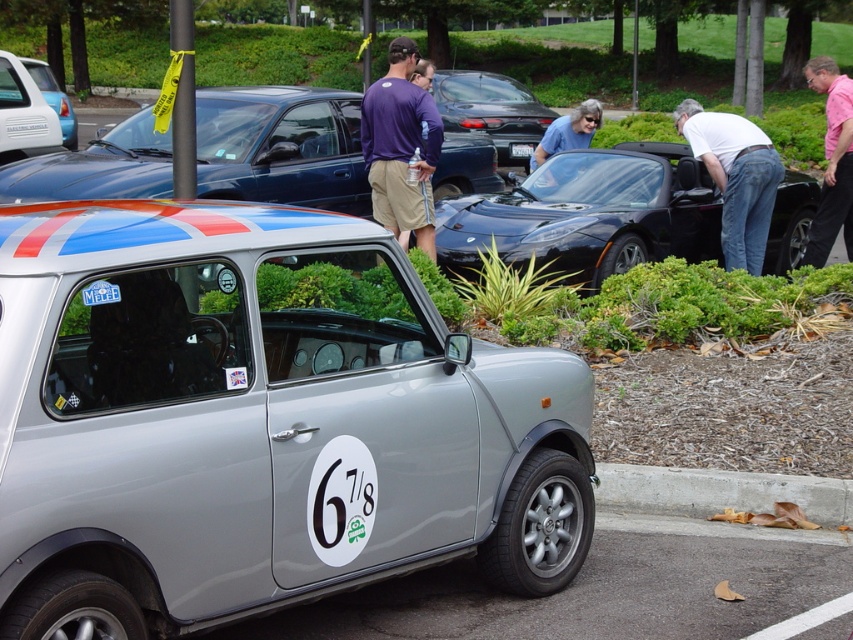
Does point (704, 113) lie behind point (67, 100)?

No, (704, 113) is in front of (67, 100).

Locate an element on the screen. Image resolution: width=853 pixels, height=640 pixels. white cotton shirt at right is located at coordinates (735, 177).

Is metallic silver car at center positioned in front of white plastic license plate at center?

No, it is behind white plastic license plate at center.

Is point (62, 106) positioned before point (520, 147)?

That is False.

You are a GUI agent. You are given a task and a screenshot of the screen. Output one action in this format:
    pyautogui.click(x=<x>, y=<y>)
    Task: Click on the metallic silver car at center
    The width and height of the screenshot is (853, 640).
    Given the screenshot: What is the action you would take?
    pyautogui.click(x=54, y=99)

Image resolution: width=853 pixels, height=640 pixels. Describe the element at coordinates (258, 420) in the screenshot. I see `satin silver car at center` at that location.

Who is lower down, satin silver car at center or gray fabric shirt at center?

satin silver car at center

Does point (184, 266) lie behind point (585, 116)?

No, it is not.

Where is `satin silver car at center`? This screenshot has width=853, height=640. satin silver car at center is located at coordinates (258, 420).